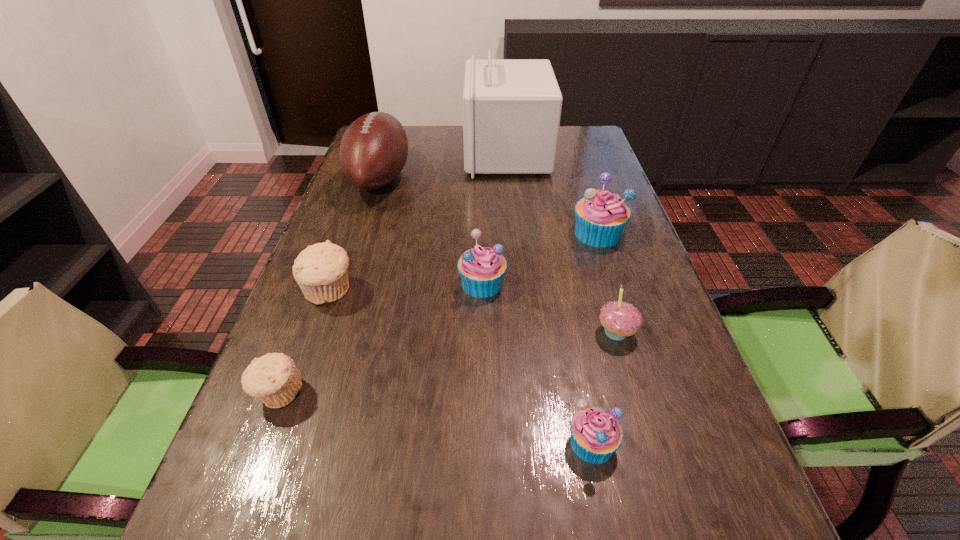
I want to click on the first-aid kit, so [x=512, y=108].

At what (x,y) coordinates should I click in order to perform the action: click on white first-aid kit. Please return your answer as a coordinate pair (x, y). Image resolution: width=960 pixels, height=540 pixels. Looking at the image, I should click on (512, 108).

You are a GUI agent. You are given a task and a screenshot of the screen. Output one action in this format:
    pyautogui.click(x=<x>, y=<y>)
    Task: Click on the brown football (American)
    This screenshot has width=960, height=540.
    Given the screenshot: What is the action you would take?
    pyautogui.click(x=374, y=148)

Find the location of a particular element. This screenshot has height=540, width=960. football (American) is located at coordinates (374, 148).

This screenshot has width=960, height=540. Identify the location of the rightmost muffin. (601, 216).

Where is `the rightmost blue muffin`? Image resolution: width=960 pixels, height=540 pixels. the rightmost blue muffin is located at coordinates (601, 216).

Locate an element on the screen. This screenshot has width=960, height=540. the leftmost blue muffin is located at coordinates (482, 269).

Find the location of a particular element. the second farthest blue muffin is located at coordinates (482, 269).

This screenshot has width=960, height=540. I want to click on the farther beige muffin, so click(320, 270).

Where is `the third nearest object`? the third nearest object is located at coordinates (620, 319).